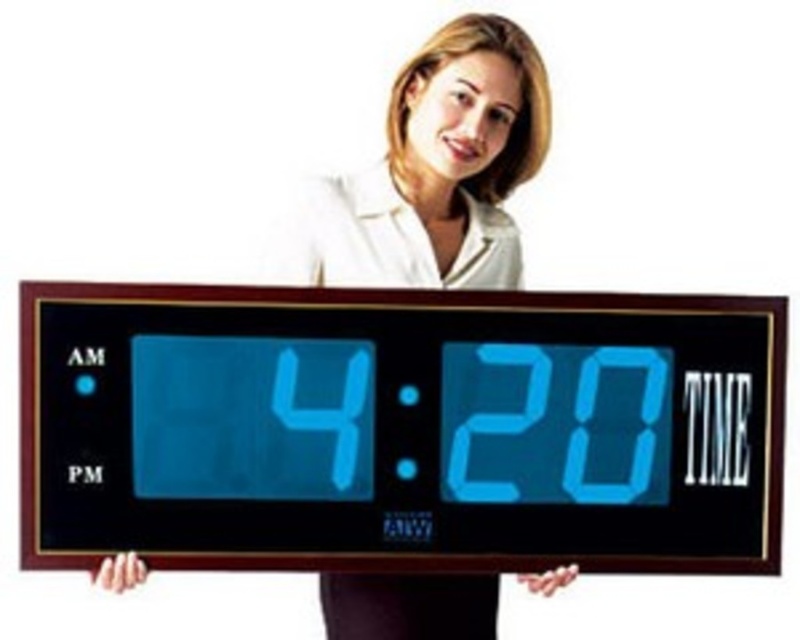
Which is more to the left, blue lcd display at center or white smooth shirt at upper center?

blue lcd display at center is more to the left.

Between point (772, 310) and point (452, 179), which one is positioned behind?

Point (452, 179)

At what (x,y) coordinates should I click in order to perform the action: click on blue lcd display at center. Please return your answer as a coordinate pair (x, y). The image size is (800, 640). Looking at the image, I should click on (400, 428).